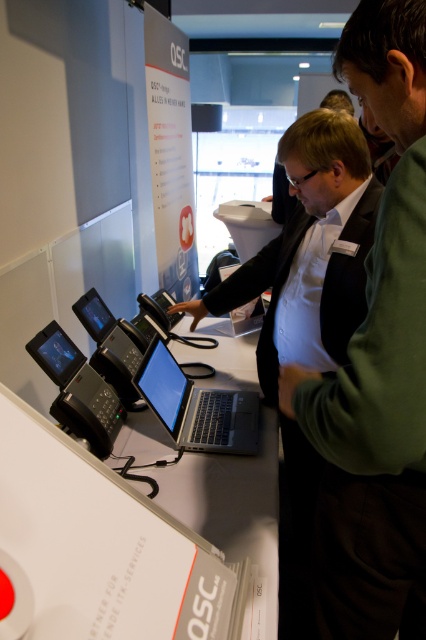
You are a photographer standing at the exhibition booth. You want to capture a clear photo of the green fabric shirt at center without any obstructions. The camera you are using has a minimum focusing distance of 25 inches. Can you take the photo from your current position?

The green fabric shirt at center is 24.73 inches away from viewer. Since the minimum focusing distance of the camera is 25 inches, the photographer cannot take a clear photo from the current position because the shirt is too close.

You are a photographer at the exhibition. You want to take a photo of the satin black laptop at center without the green fabric shirt at center blocking it. What should you do?

Move the green fabric shirt at center away from the satin black laptop at center since the green fabric shirt at center is currently in front of the satin black laptop at center and blocking the view.

You are a photographer at the exhibition. You need to take a photo of the satin black laptop at center and the green fabric shirt at center. From the photographer perspective, which object should be positioned to the left in the frame?

The satin black laptop at center should be positioned to the left in the frame because the green fabric shirt at center is to the right of it.